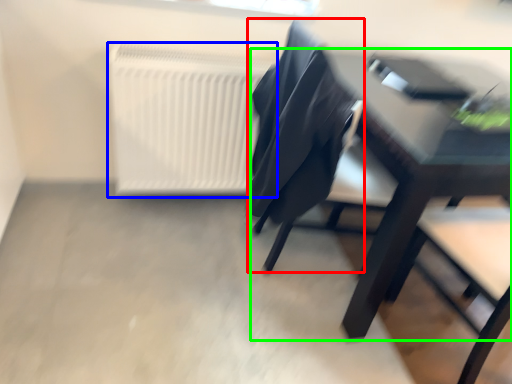
Question: Considering the real-world distances, which object is farthest from chair (highlighted by a red box)? radiator (highlighted by a blue box) or table (highlighted by a green box)?

Choices:
 (A) radiator
 (B) table

Answer: (A)